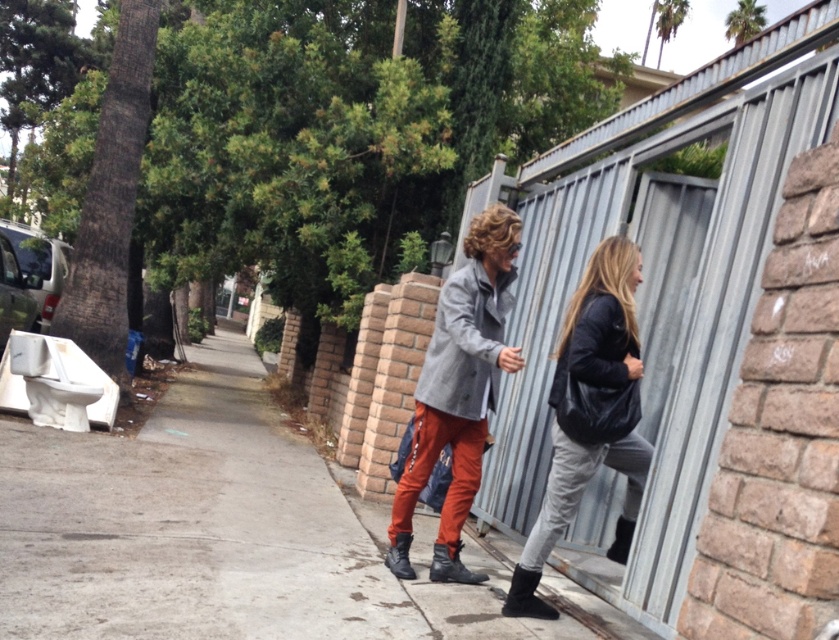
You are a pedestrian standing on the concrete sidewalk at center and want to walk towards the matte gray coat at center. In which direction should you move?

You should move to the right because the concrete sidewalk at center is to the left of the matte gray coat at center, so moving right along the sidewalk will bring you closer to the matte gray coat at center.

You are a delivery person trying to squeeze between two people on a narrow sidewalk. The people are wearing the black leather jacket at right and the matte gray coat at center. Which person should you move closer to if you need to pass through?

You should move closer to the black leather jacket at right because it is thinner than the matte gray coat at center, making it easier to pass through.

You are standing at the point marked by coordinates point (274, 538) in the street scene. You want to walk to the nearest building entrance located 5 meters away from your current position. Can you safely walk straight ahead without crossing any obstacles?

The distance between you and the viewer is 4.28 meters, so walking straight ahead would not reach the entrance located 5 meters away. You need to adjust your path or move further forward to reach the entrance.